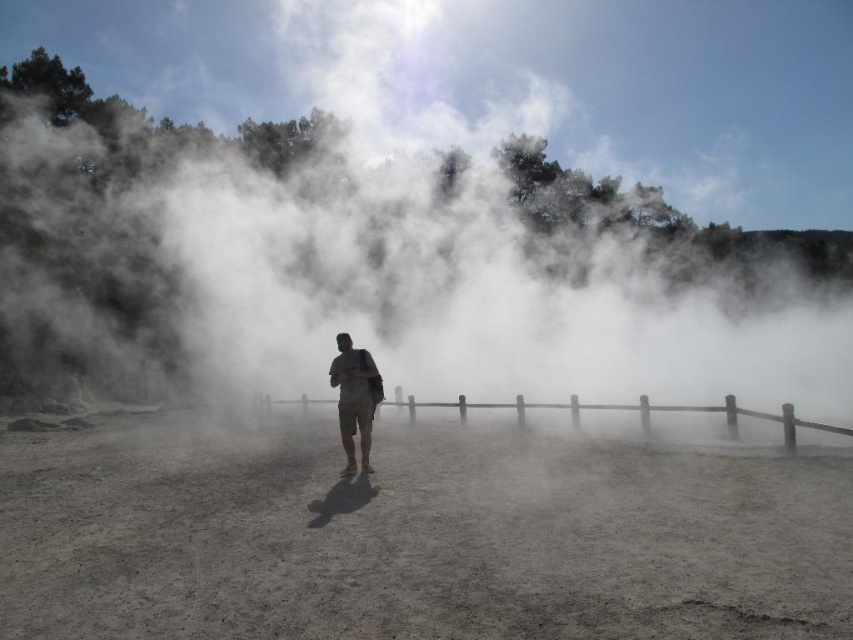
You are standing at point (378, 380) and want to walk to point (692, 412). Which direction should you move relative to your current position?

You should move towards the camera direction since point (692, 412) is closer to the camera than point (378, 380).

You are a park ranger assessing the safety of visitors near the geothermal area. You notice the brown wooden fence at center and the tan cotton shorts at center. Which object is bigger in size?

The brown wooden fence at center is larger in size compared to the tan cotton shorts at center.

You are planning to take a photo of the geothermal area. You want to include both the brown wooden fence at center and the tan cotton shorts at center in the frame. Which object should you focus on first to ensure both are in focus?

You should focus on the brown wooden fence at center first because its width is larger than the tan cotton shorts at center, making it easier to capture both in focus.